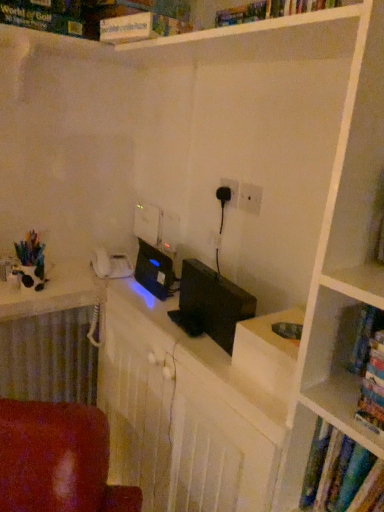
Question: Is white matte puzzle box at upper center to the left or to the right of multicolored paper book at right, the 2th book from the bottom, in the image?

Choices:
 (A) left
 (B) right

Answer: (A)

Question: Would you say white matte puzzle box at upper center is inside or outside multicolored paper book at right, which is the 1th book in top-to-bottom order?

Choices:
 (A) outside
 (B) inside

Answer: (A)

Question: Considering the real-world distances, which object is closest to the black matte computer monitor at center?

Choices:
 (A) white plastic electric outlet at center, which appears as the 1th electric outlet when viewed from the front
 (B) multicolored paper book at right, which is the 1th book in top-to-bottom order
 (C) hardcover book at right, arranged as the 1th book when viewed from the back
 (D) white textured radiator at lower left
 (E) black plastic computer desk at center

Answer: (E)

Question: Which of these objects is positioned farthest from the black matte computer monitor at center?

Choices:
 (A) multicolored paper book at right, the 2th book from the bottom
 (B) black plastic computer desk at center
 (C) black plastic electric outlet at center, the 1th electric outlet positioned from the back
 (D) white textured radiator at lower left
 (E) white matte puzzle box at upper center

Answer: (E)